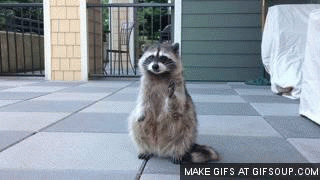
Identify the location of chair. (123, 39).